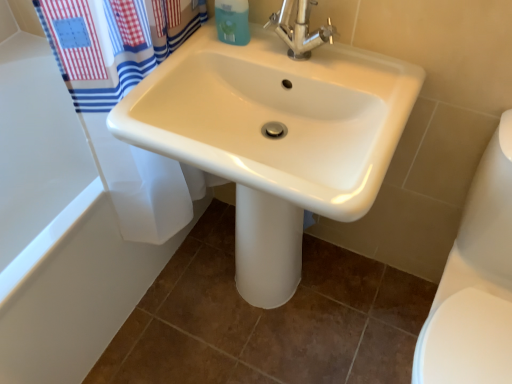
Describe the element at coordinates (475, 282) in the screenshot. I see `white glossy toilet bowl at lower right` at that location.

Describe the element at coordinates (275, 137) in the screenshot. I see `white glossy sink at center` at that location.

At what (x,y) coordinates should I click in order to perform the action: click on blue matte soap dispenser at upper center. Please return your answer as a coordinate pair (x, y). Looking at the image, I should click on click(232, 21).

Is white glossy sink at center facing towards chrome metallic faucet at upper center?

No, white glossy sink at center is not facing towards chrome metallic faucet at upper center.

Considering the sizes of objects white glossy sink at center and chrome metallic faucet at upper center in the image provided, who is wider, white glossy sink at center or chrome metallic faucet at upper center?

white glossy sink at center.

Locate an element on the screen. tap that appears above the white glossy sink at center (from a real-world perspective) is located at coordinates point(300,29).

Who is taller, white glossy sink at center or chrome metallic faucet at upper center?

white glossy sink at center.

Is blue matte soap dispenser at upper center thinner than white glossy toilet bowl at lower right?

Yes, blue matte soap dispenser at upper center is thinner than white glossy toilet bowl at lower right.

From the picture: Which is more to the left, blue matte soap dispenser at upper center or white glossy toilet bowl at lower right?

blue matte soap dispenser at upper center.

Find the location of `toiletry above the white glossy toilet bowl at lower right (from a real-world perspective)`. toiletry above the white glossy toilet bowl at lower right (from a real-world perspective) is located at coordinates (232, 21).

Does blue matte soap dispenser at upper center have a lesser height compared to white glossy toilet bowl at lower right?

Indeed, blue matte soap dispenser at upper center has a lesser height compared to white glossy toilet bowl at lower right.

Is white glossy bathtub at upper left to the right of white glossy sink at center from the viewer's perspective?

No, white glossy bathtub at upper left is not to the right of white glossy sink at center.

Consider the image. Does white glossy bathtub at upper left have a larger size compared to white glossy sink at center?

Correct, white glossy bathtub at upper left is larger in size than white glossy sink at center.

You are a GUI agent. You are given a task and a screenshot of the screen. Output one action in this format:
    pyautogui.click(x=<x>, y=<y>)
    Task: Click on the sink on the right of the white glossy bathtub at upper left
    The image size is (512, 384).
    Given the screenshot: What is the action you would take?
    pyautogui.click(x=275, y=137)

What's the angular difference between white glossy bathtub at upper left and white glossy sink at center's facing directions?

They differ by 89 degrees in their facing directions.

Is white glossy sink at center oriented towards blue matte soap dispenser at upper center?

No, white glossy sink at center does not turn towards blue matte soap dispenser at upper center.

Which point is more forward, [150,85] or [229,40]?

Point [150,85]

Find the location of a particular element. sink below the blue matte soap dispenser at upper center (from a real-world perspective) is located at coordinates click(x=275, y=137).

Can you tell me how much white glossy sink at center and blue matte soap dispenser at upper center differ in facing direction?

There is a 0.000255-degree angle between the facing directions of white glossy sink at center and blue matte soap dispenser at upper center.

Are white glossy bathtub at upper left and chrome metallic faucet at upper center beside each other?

white glossy bathtub at upper left is not next to chrome metallic faucet at upper center, and they're not touching.

In the image, is white glossy bathtub at upper left on the left side or the right side of chrome metallic faucet at upper center?

white glossy bathtub at upper left is to the left of chrome metallic faucet at upper center.

Is white glossy bathtub at upper left not within chrome metallic faucet at upper center?

That's correct, white glossy bathtub at upper left is outside of chrome metallic faucet at upper center.

Find the location of a particular element. bath below the chrome metallic faucet at upper center (from a real-world perspective) is located at coordinates (68, 222).

Who is taller, white glossy bathtub at upper left or white glossy toilet bowl at lower right?

Standing taller between the two is white glossy toilet bowl at lower right.

Does white glossy bathtub at upper left appear on the right side of white glossy toilet bowl at lower right?

No, white glossy bathtub at upper left is not to the right of white glossy toilet bowl at lower right.

Between white glossy sink at center and white glossy toilet bowl at lower right, which one has larger width?

Wider between the two is white glossy toilet bowl at lower right.

Looking at the image, does white glossy sink at center seem bigger or smaller compared to white glossy toilet bowl at lower right?

In the image, white glossy sink at center appears to be larger than white glossy toilet bowl at lower right.

Based on the photo, can you tell me how much white glossy sink at center and white glossy toilet bowl at lower right differ in facing direction?

They differ by 1.53 degrees in their facing directions.

From the image's perspective, is white glossy sink at center located beneath white glossy toilet bowl at lower right?

No.

Identify the location of sink below the chrome metallic faucet at upper center (from the image's perspective). This screenshot has height=384, width=512. (275, 137).

Where is `toiletry above the white glossy toilet bowl at lower right (from the image's perspective)`? This screenshot has width=512, height=384. toiletry above the white glossy toilet bowl at lower right (from the image's perspective) is located at coordinates (232, 21).

In the scene shown: Based on their spatial positions, is white glossy sink at center or blue matte soap dispenser at upper center further from white glossy toilet bowl at lower right?

blue matte soap dispenser at upper center is further to white glossy toilet bowl at lower right.

Considering their positions, is chrome metallic faucet at upper center positioned closer to white glossy toilet bowl at lower right than white glossy bathtub at upper left?

The object closer to white glossy toilet bowl at lower right is chrome metallic faucet at upper center.

Based on their spatial positions, is chrome metallic faucet at upper center or white glossy bathtub at upper left closer to blue matte soap dispenser at upper center?

chrome metallic faucet at upper center.

Considering their positions, is white glossy toilet bowl at lower right positioned further to blue matte soap dispenser at upper center than chrome metallic faucet at upper center?

Among the two, white glossy toilet bowl at lower right is located further to blue matte soap dispenser at upper center.

Estimate the real-world distances between objects in this image. Which object is closer to white glossy sink at center, white glossy bathtub at upper left or chrome metallic faucet at upper center?

chrome metallic faucet at upper center is positioned closer to the anchor white glossy sink at center.

From the image, which object appears to be nearer to chrome metallic faucet at upper center, white glossy sink at center or white glossy toilet bowl at lower right?

white glossy sink at center lies closer to chrome metallic faucet at upper center than the other object.

Which object lies further to the anchor point white glossy bathtub at upper left, chrome metallic faucet at upper center or white glossy toilet bowl at lower right?

white glossy toilet bowl at lower right lies further to white glossy bathtub at upper left than the other object.

From the image, which object appears to be nearer to chrome metallic faucet at upper center, white glossy toilet bowl at lower right or white glossy bathtub at upper left?

white glossy toilet bowl at lower right.

Locate an element on the screen. The image size is (512, 384). sink situated between white glossy bathtub at upper left and white glossy toilet bowl at lower right from left to right is located at coordinates (275, 137).

Identify the location of toiletry between white glossy bathtub at upper left and white glossy sink at center from left to right. The image size is (512, 384). (232, 21).

Where is `toiletry between white glossy bathtub at upper left and chrome metallic faucet at upper center from left to right`? toiletry between white glossy bathtub at upper left and chrome metallic faucet at upper center from left to right is located at coordinates (232, 21).

I want to click on tap located between white glossy bathtub at upper left and white glossy toilet bowl at lower right in the left-right direction, so click(300, 29).